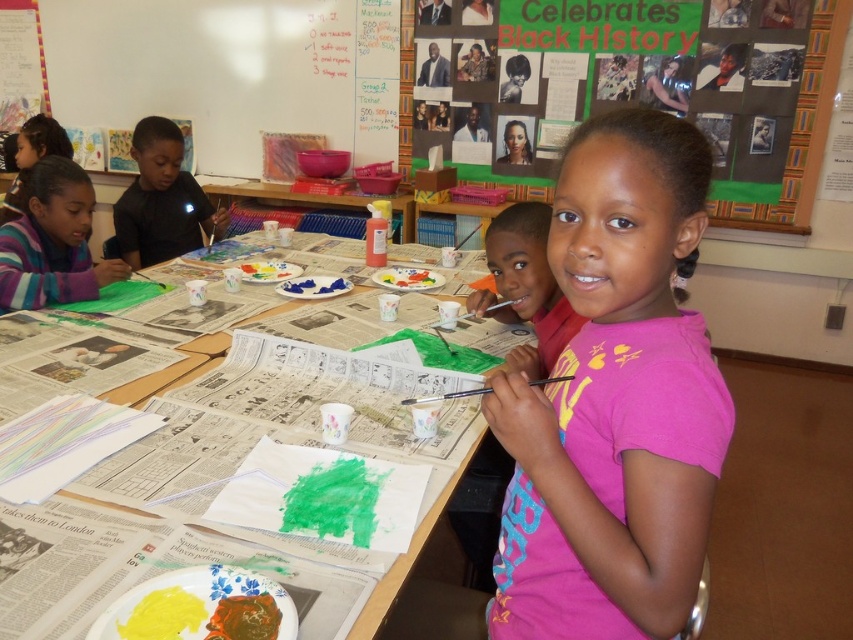
You are a teacher standing at the front of the classroom. You need to hang a poster on the green matte bulletin board at upper center. If your arm reaches 2 meters, can you reach it without a ladder?

The green matte bulletin board at upper center is 3.08 meters from camera. Since your arm reaches 2 meters, you cannot reach it without a ladder.